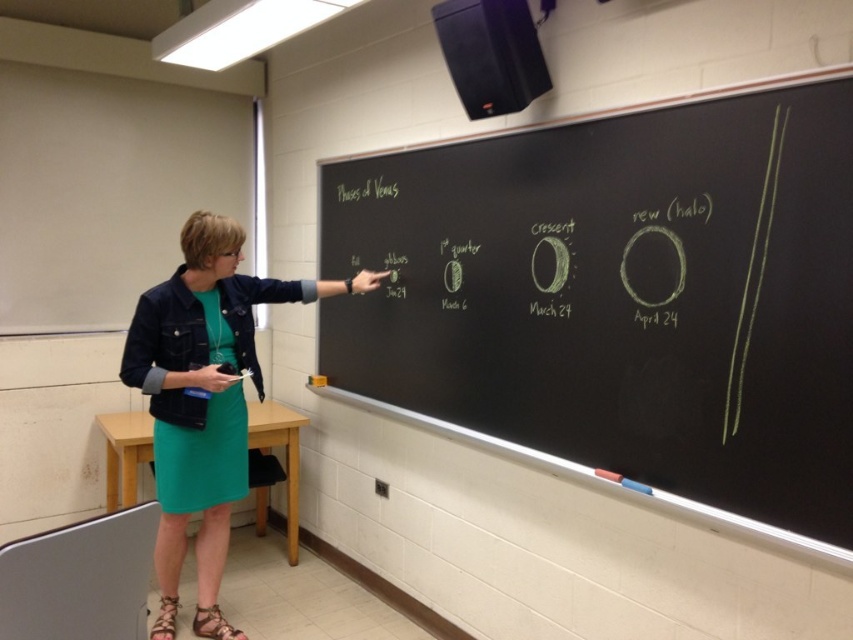
You are a student sitting in the classroom. You notice the green chalkboard at upper center and the green fabric dress at center. Which object is higher up in the image?

The green chalkboard at upper center is positioned over the green fabric dress at center, so it is higher up in the image.

You are a student sitting at the desk in the classroom. You want to look at the green chalkboard at upper center. Where should you look?

You should look upward since the green chalkboard at upper center is located at point (621, 300), which is above your eye level.

You are a student sitting at the back of the classroom. You need to hand a note to the teacher who is standing near the green chalkboard at upper center. The note is on your desk, which is near the green fabric dress at center. Can you reach the teacher without moving from your seat?

The green chalkboard at upper center and green fabric dress at center are 33.97 inches apart. Since the distance between them is less than an average person arm length, you can reach the teacher by extending your arm from the green fabric dress at center to the green chalkboard at upper center.